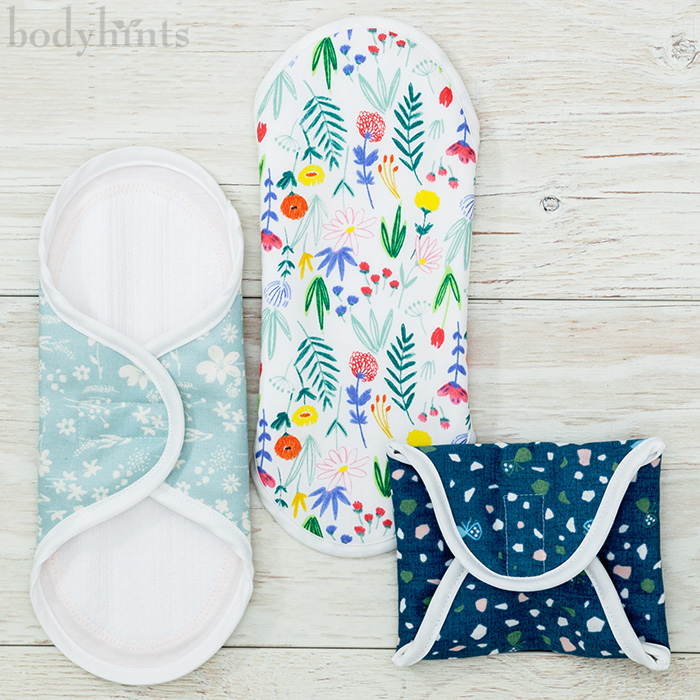
Where is `table top`? table top is located at coordinates (565, 217).